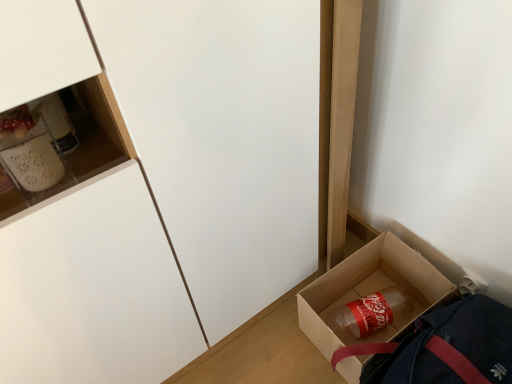
Question: Is translucent plastic bottle at lower right oriented towards matte white cabinet at lower left?

Choices:
 (A) no
 (B) yes

Answer: (A)

Question: From the image's perspective, is translucent plastic bottle at lower right located above matte white cabinet at lower left?

Choices:
 (A) no
 (B) yes

Answer: (A)

Question: Does translucent plastic bottle at lower right appear on the right side of matte white cabinet at lower left?

Choices:
 (A) yes
 (B) no

Answer: (A)

Question: Is translucent plastic bottle at lower right far away from matte white cabinet at lower left?

Choices:
 (A) no
 (B) yes

Answer: (A)

Question: From a real-world perspective, is translucent plastic bottle at lower right on matte white cabinet at lower left?

Choices:
 (A) no
 (B) yes

Answer: (A)

Question: From the image's perspective, is translucent plastic bottle at lower right located beneath matte white cabinet at lower left?

Choices:
 (A) no
 (B) yes

Answer: (B)

Question: Is brown cardboard box at lower right at the back of matte white cabinet at lower left?

Choices:
 (A) yes
 (B) no

Answer: (B)

Question: Is matte white cabinet at lower left located outside brown cardboard box at lower right?

Choices:
 (A) no
 (B) yes

Answer: (B)

Question: From the image's perspective, does matte white cabinet at lower left appear higher than brown cardboard box at lower right?

Choices:
 (A) yes
 (B) no

Answer: (A)

Question: Can you confirm if matte white cabinet at lower left is wider than brown cardboard box at lower right?

Choices:
 (A) yes
 (B) no

Answer: (A)

Question: Does matte white cabinet at lower left come in front of brown cardboard box at lower right?

Choices:
 (A) no
 (B) yes

Answer: (B)

Question: Is matte white cabinet at lower left not near brown cardboard box at lower right?

Choices:
 (A) no
 (B) yes

Answer: (A)

Question: Is brown cardboard box at lower right next to translucent plastic bottle at lower right and touching it?

Choices:
 (A) no
 (B) yes

Answer: (B)